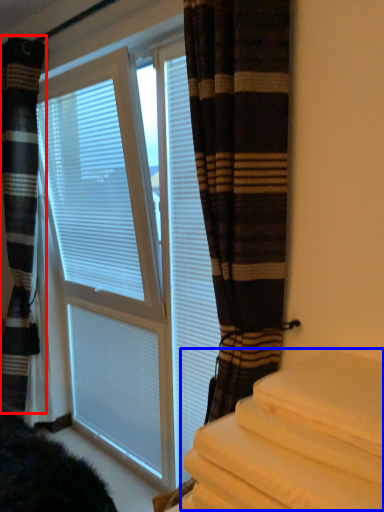
Question: Which point is further to the camera, curtain (highlighted by a red box) or bedding (highlighted by a blue box)?

Choices:
 (A) curtain
 (B) bedding

Answer: (A)